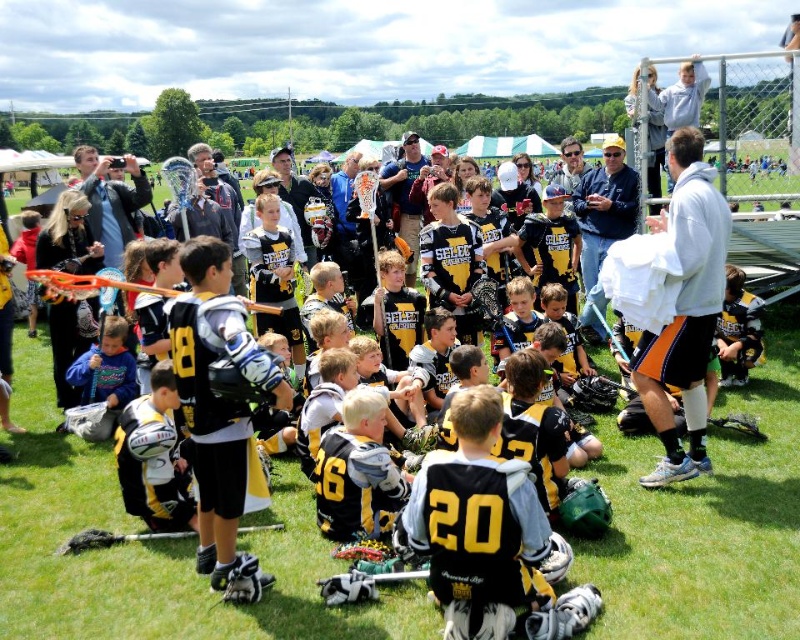
Question: Among these objects, which one is nearest to the camera?

Choices:
 (A) black/yellow jersey at center
 (B) black matte jersey at center

Answer: (B)

Question: Is black/yellow jersey at center further to the viewer compared to black matte jersey at center?

Choices:
 (A) no
 (B) yes

Answer: (B)

Question: Does black/yellow jersey at center have a greater width compared to black matte jersey at center?

Choices:
 (A) no
 (B) yes

Answer: (A)

Question: Which object is farther from the camera taking this photo?

Choices:
 (A) black matte jersey at center
 (B) black/yellow jersey at center

Answer: (B)

Question: From the image, what is the correct spatial relationship of black/yellow jersey at center in relation to black matte jersey at center?

Choices:
 (A) below
 (B) above

Answer: (A)